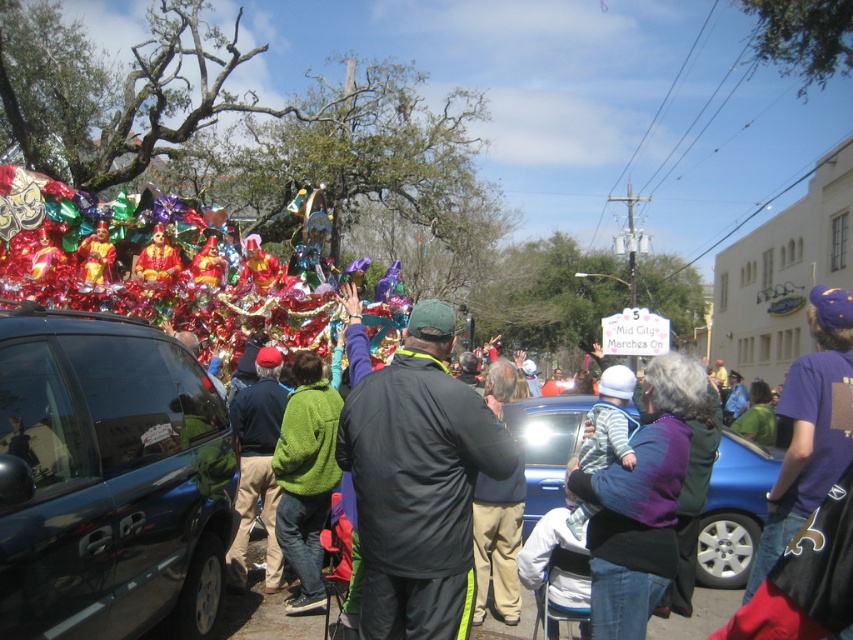
Does glossy dark blue van at left have a lesser width compared to blue metallic car at center?

Yes.

Which is more to the right, glossy dark blue van at left or blue metallic car at center?

From the viewer's perspective, blue metallic car at center appears more on the right side.

The height and width of the screenshot is (640, 853). Find the location of `glossy dark blue van at left`. glossy dark blue van at left is located at coordinates (107, 480).

Find the location of a particular element. Image resolution: width=853 pixels, height=640 pixels. glossy dark blue van at left is located at coordinates [107, 480].

Based on the photo, is glossy dark blue van at left in front of green fuzzy sweater at center?

Yes.

Can you confirm if glossy dark blue van at left is wider than green fuzzy sweater at center?

Indeed, glossy dark blue van at left has a greater width compared to green fuzzy sweater at center.

Describe the element at coordinates (107, 480) in the screenshot. I see `glossy dark blue van at left` at that location.

I want to click on glossy dark blue van at left, so click(x=107, y=480).

Does black fabric jacket at center appear on the right side of green fuzzy sweater at center?

Indeed, black fabric jacket at center is positioned on the right side of green fuzzy sweater at center.

Which is more to the left, black fabric jacket at center or green fuzzy sweater at center?

Positioned to the left is green fuzzy sweater at center.

Which is in front, point (374, 525) or point (326, 454)?

Point (374, 525) is more forward.

The width and height of the screenshot is (853, 640). I want to click on black fabric jacket at center, so click(x=418, y=483).